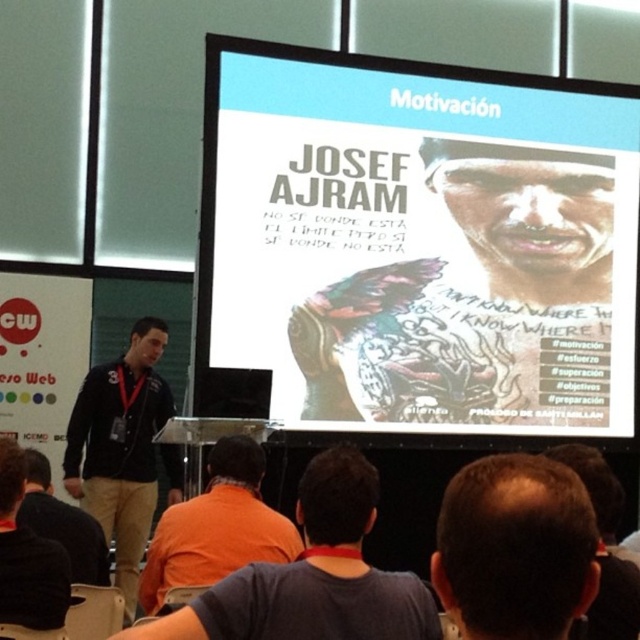
Question: Which object is the farthest from the dark brown leather jacket at lower left?

Choices:
 (A) dark brown hair at upper center
 (B) brown hair at upper right

Answer: (B)

Question: Can you confirm if dark brown hair at upper center is positioned above black fabric shirt at lower left?

Choices:
 (A) yes
 (B) no

Answer: (A)

Question: Which point is farther to the camera?

Choices:
 (A) orange shirt at center
 (B) dark brown leather jacket at lower left
 (C) white glossy projection screen at upper center

Answer: (C)

Question: In this image, where is white glossy projection screen at upper center located relative to black fabric jacket at left?

Choices:
 (A) left
 (B) right

Answer: (B)

Question: From the image, what is the correct spatial relationship of orange fabric shirt at lower center in relation to black fabric jacket at left?

Choices:
 (A) right
 (B) left

Answer: (A)

Question: Which is nearer to the dark brown leather jacket at lower left?

Choices:
 (A) dark brown hair at upper center
 (B) white glossy projection screen at upper center

Answer: (A)